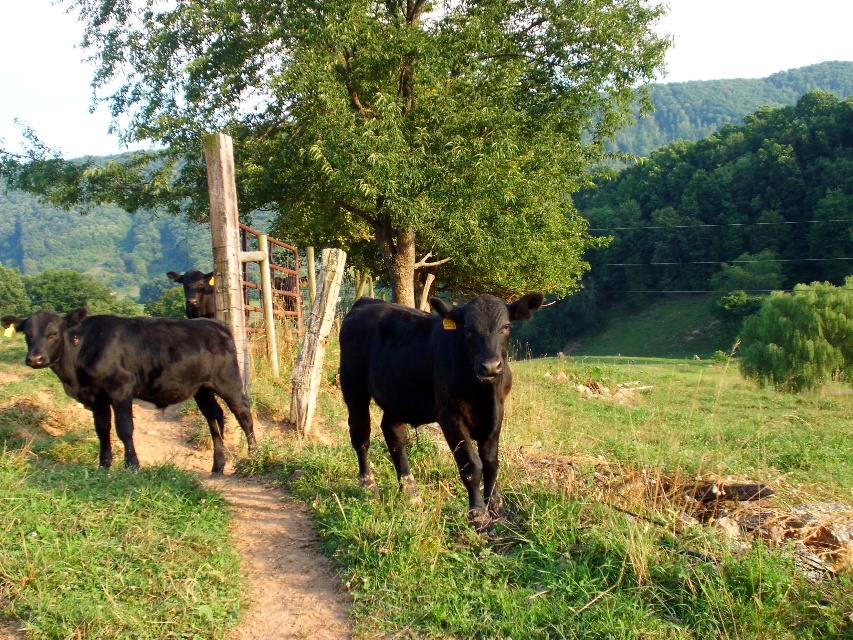
You are standing at the dirt path in the foreground and want to walk towards the fence where the cows are. Which of the two points, point (x=395, y=83) or point (x=276, y=548), would you reach first?

You would reach point (x=276, y=548) first because it is closer to you than point (x=395, y=83), which is further away.

You are a farmer walking along the dirt path at center and want to reach the green leafy tree at center to check its health. Which direction should you walk towards?

The green leafy tree at center is positioned on the left side of dirt path at center, so you should walk towards the left side of the dirt path at center to reach it.

You are a drone operator trying to capture a photo of the cows near the wooden fence. Your drone is currently hovering at the point with coordinates 0.7, 0.7. To ensure the green grassy at center is in the background, should you move your drone north or south? Please explain your reasoning based on the coordinates provided.

The green grassy at center is located at coordinates [587,513]. Since your drone is at [596,448], moving north would increase the y coordinate. The grassy area has a lower y coordinate than the drone, so moving south would bring the drone closer to the grassy area. Wait, actually, in coordinate systems, lower y coordinates are typically south. Hmm, maybe I need to think differently. Let me visualize this. If the grassy area is at 0.689 in y, which is lower than 0.7, that means it is south of the drone. So